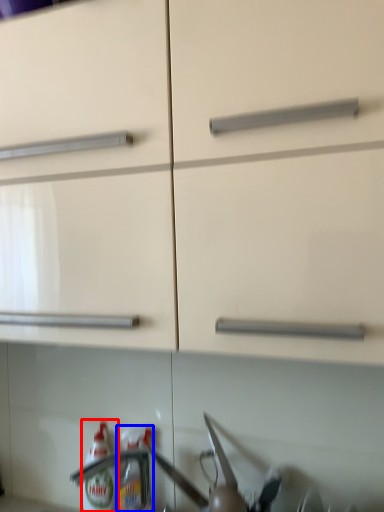
Question: Which of the following is the closest to the observer, bottle (highlighted by a red box) or bottle (highlighted by a blue box)?

Choices:
 (A) bottle
 (B) bottle

Answer: (B)